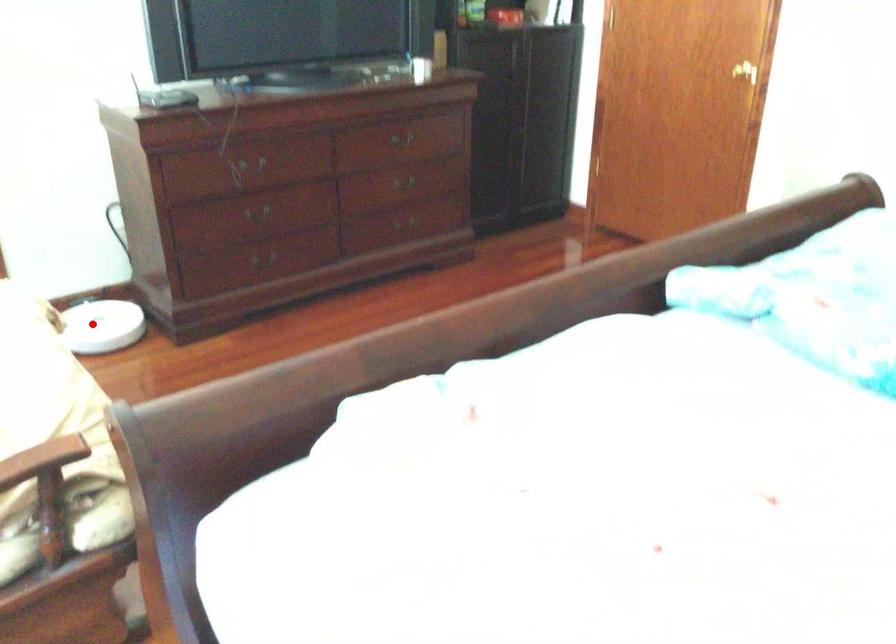
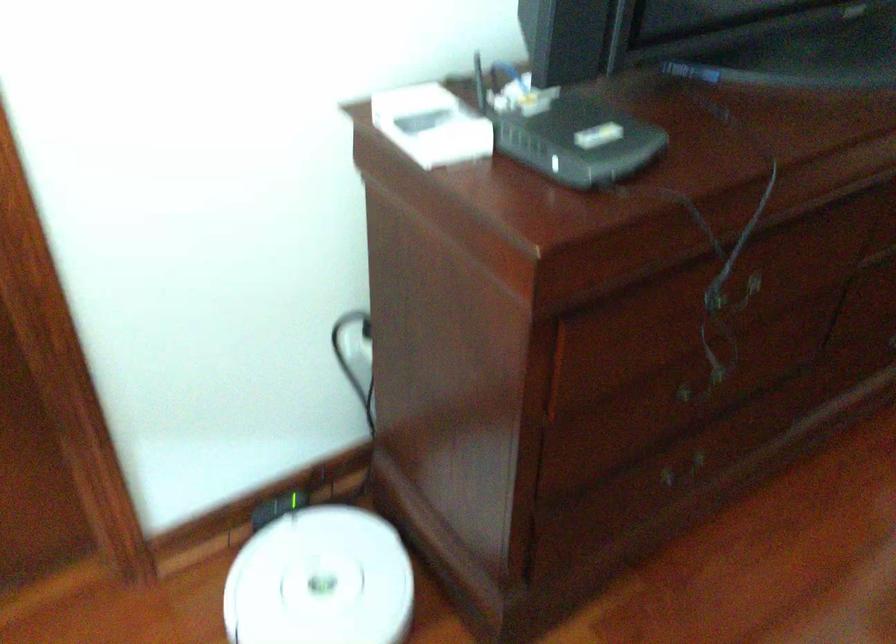
Find the pixel in the second image that matches the highlighted location in the first image.

(321, 581)